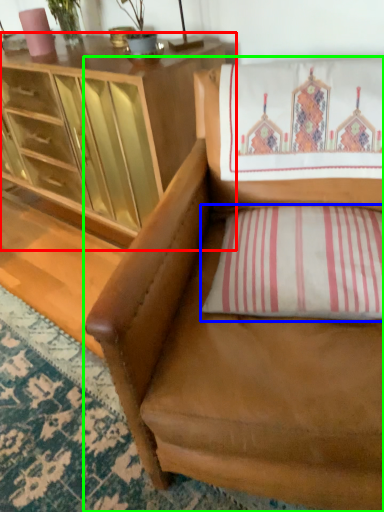
Question: Which is nearer to the cabinetry (highlighted by a red box)? pillow (highlighted by a blue box) or chair (highlighted by a green box).

Choices:
 (A) pillow
 (B) chair

Answer: (B)